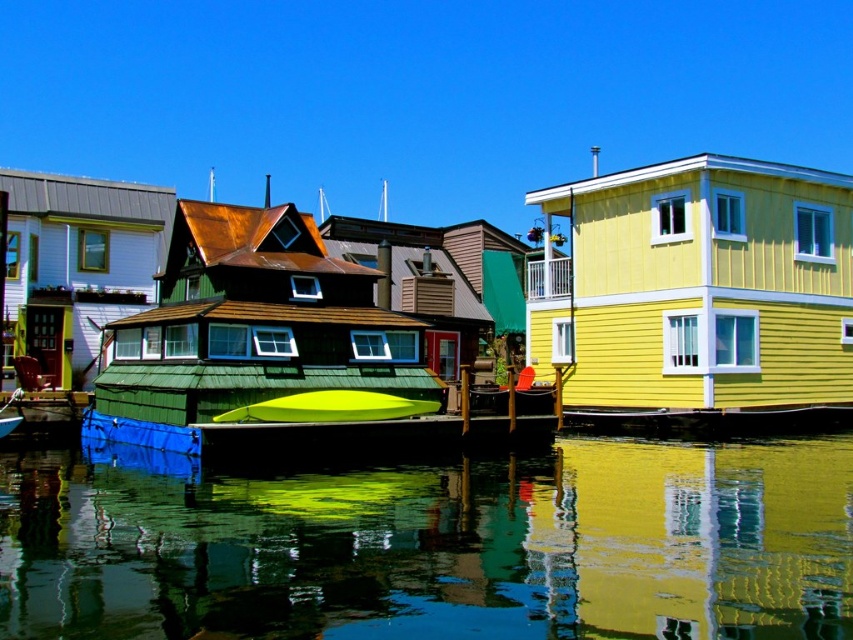
You are standing on the bright yellow houseboat with white framed windows and a clean smooth exterior. You see two points marked in the image, point (x=141, y=560) and point (x=346, y=417). Which point is closer to you?

Point (x=141, y=560) is in front of point (x=346, y=417), so it is closer to you.